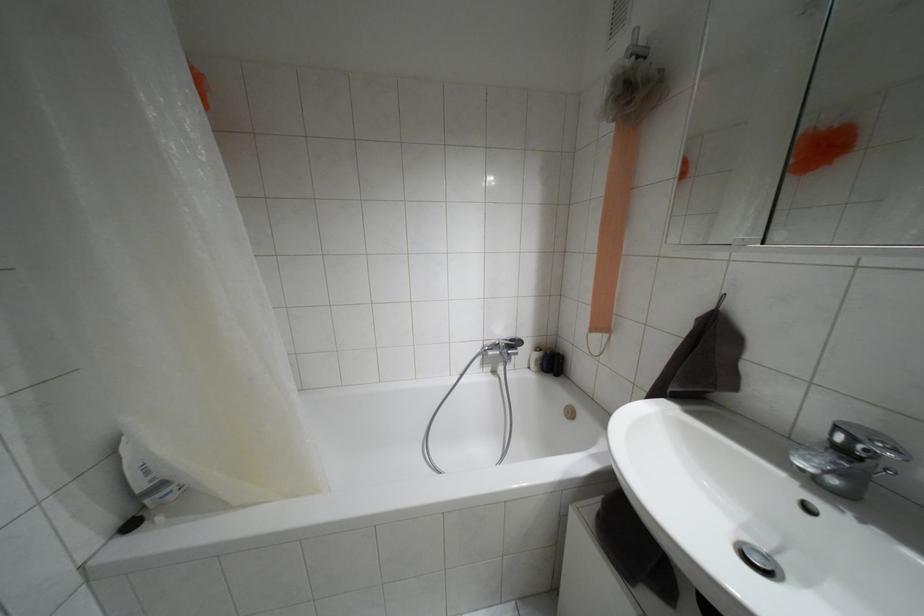
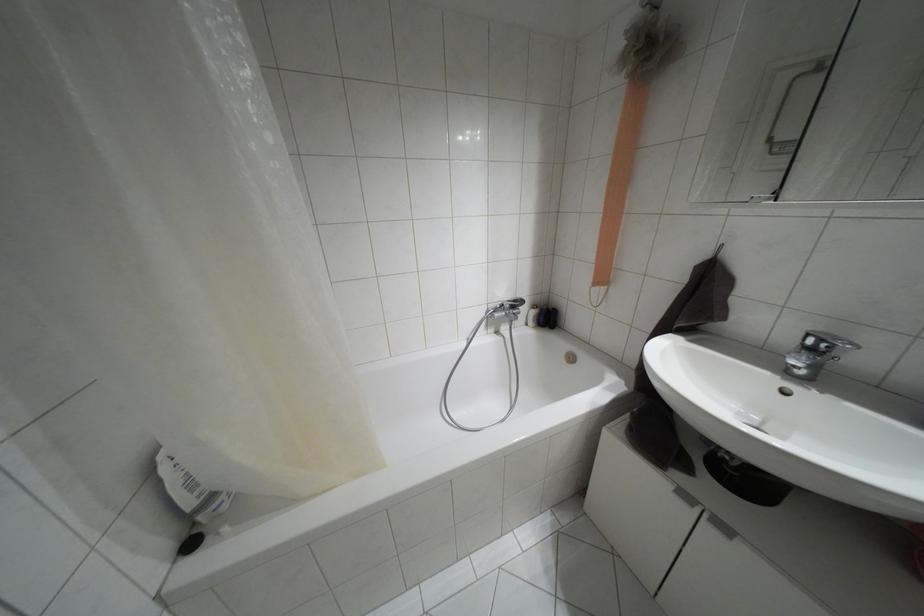
Where in the second image is the point corresponding to pixel 835 427 from the first image?

(808, 334)